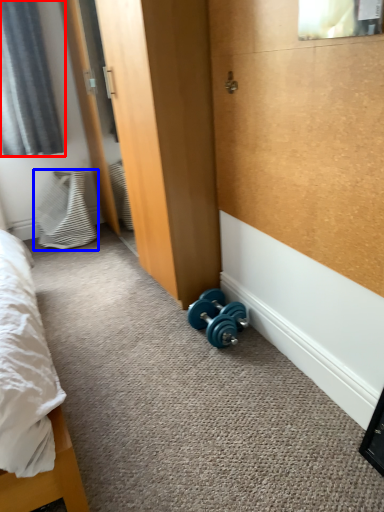
Question: Which point is further to the camera, curtain (highlighted by a red box) or pillow (highlighted by a blue box)?

Choices:
 (A) curtain
 (B) pillow

Answer: (B)